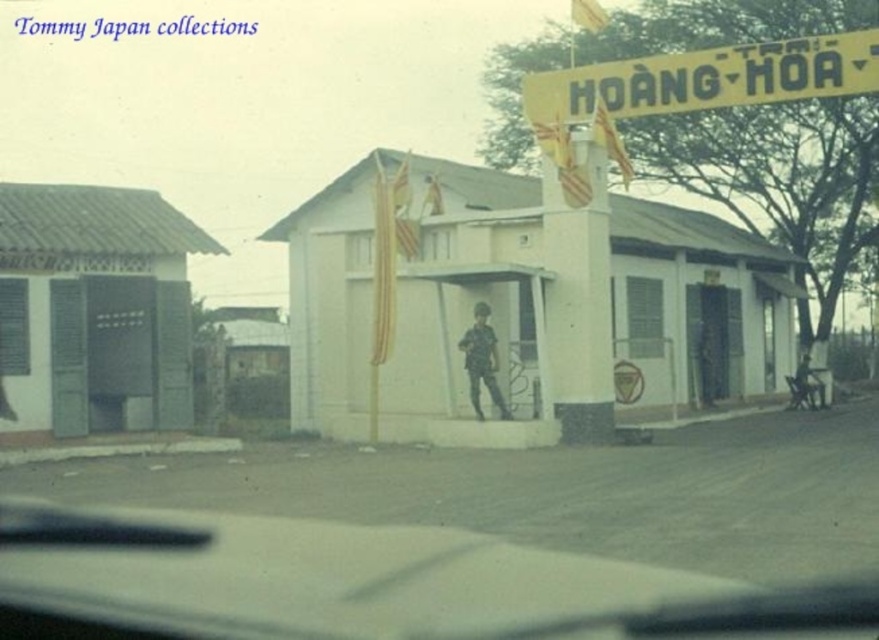
Question: Is yellow paper banner at upper center to the left of camouflage fabric uniform at center from the viewer's perspective?

Choices:
 (A) no
 (B) yes

Answer: (A)

Question: Does transparent glass windshield at center lie behind camouflage fabric uniform at center?

Choices:
 (A) yes
 (B) no

Answer: (B)

Question: Which point is closer to the camera taking this photo?

Choices:
 (A) (738, 56)
 (B) (489, 324)

Answer: (A)

Question: Is yellow paper banner at upper center to the right of camouflage fabric uniform at center from the viewer's perspective?

Choices:
 (A) yes
 (B) no

Answer: (A)

Question: Among these points, which one is farthest from the camera?

Choices:
 (A) (191, 522)
 (B) (527, 90)
 (C) (478, 323)

Answer: (B)

Question: Which of the following is the closest to the observer?

Choices:
 (A) (469, 346)
 (B) (287, 618)
 (C) (563, 100)

Answer: (B)